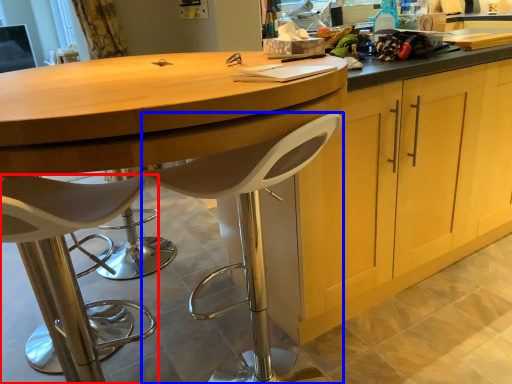
Question: Which point is closer to the camera, chair (highlighted by a red box) or chair (highlighted by a blue box)?

Choices:
 (A) chair
 (B) chair

Answer: (A)